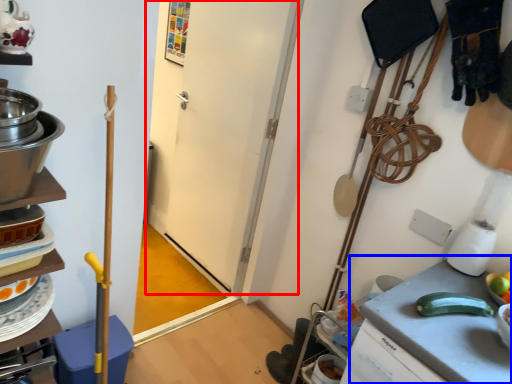
Question: Which object is closer to the camera taking this photo, door (highlighted by a red box) or counter top (highlighted by a blue box)?

Choices:
 (A) door
 (B) counter top

Answer: (B)